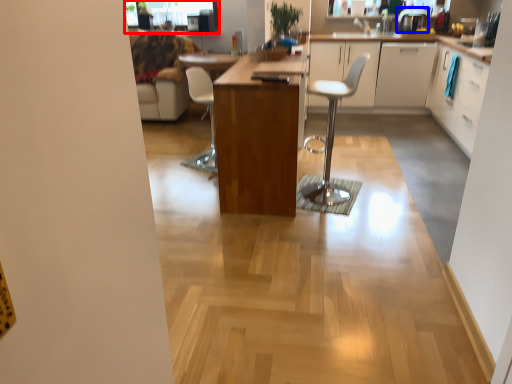
Question: Which point is closer to the camera, window screen (highlighted by a red box) or appliance (highlighted by a blue box)?

Choices:
 (A) window screen
 (B) appliance

Answer: (B)